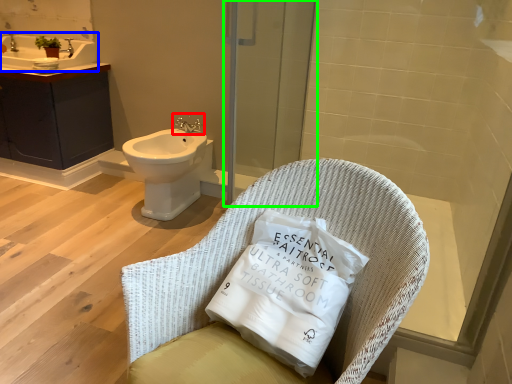
Question: Estimate the real-world distances between objects in this image. Which object is farther from tap (highlighted by a red box), sink (highlighted by a blue box) or screen door (highlighted by a green box)?

Choices:
 (A) sink
 (B) screen door

Answer: (A)